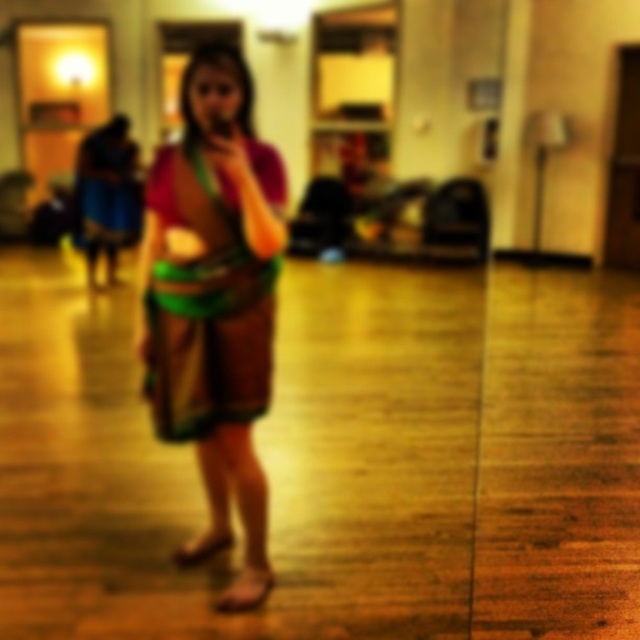
Question: Which point is farther from the camera taking this photo?

Choices:
 (A) (237, 310)
 (B) (195, 337)

Answer: (A)

Question: Which object appears closest to the camera in this image?

Choices:
 (A) multicolored fabric dress at center
 (B) matte brown dress at center

Answer: (B)

Question: Can you confirm if matte brown dress at center is positioned to the right of multicolored fabric dress at center?

Choices:
 (A) no
 (B) yes

Answer: (B)

Question: Can you confirm if matte brown dress at center is positioned below multicolored fabric dress at center?

Choices:
 (A) yes
 (B) no

Answer: (A)

Question: Can you confirm if matte brown dress at center is thinner than multicolored fabric dress at center?

Choices:
 (A) yes
 (B) no

Answer: (B)